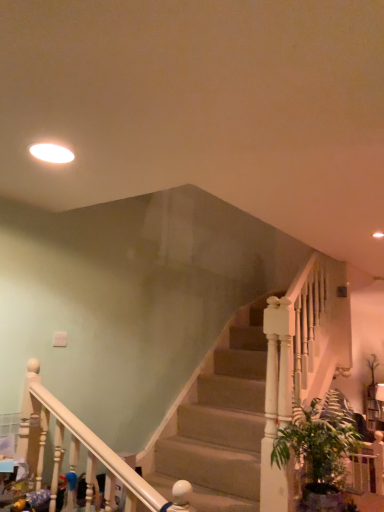
Describe the element at coordinates (51, 153) in the screenshot. The height and width of the screenshot is (512, 384). I see `white glossy light fixture at upper left` at that location.

What is the approximate width of white glossy light fixture at upper left?

It is 7.97 inches.

You are a GUI agent. You are given a task and a screenshot of the screen. Output one action in this format:
    pyautogui.click(x=<x>, y=<y>)
    Task: Click on the white glossy light fixture at upper left
    The image size is (384, 512).
    Given the screenshot: What is the action you would take?
    pyautogui.click(x=51, y=153)

Image resolution: width=384 pixels, height=512 pixels. I want to click on green leafy plant at lower right, so click(x=319, y=451).

What is the approximate width of green leafy plant at lower right?

16.85 inches.

Measure the distance between point (299, 438) and camera.

Point (299, 438) and camera are 2.38 meters apart from each other.

The image size is (384, 512). What do you see at coordinates (319, 451) in the screenshot?
I see `green leafy plant at lower right` at bounding box center [319, 451].

I want to click on white glossy light fixture at upper left, so click(51, 153).

Is green leafy plant at lower right to the right of white glossy light fixture at upper left from the viewer's perspective?

Correct, you'll find green leafy plant at lower right to the right of white glossy light fixture at upper left.

Which object is further away from the camera taking this photo, green leafy plant at lower right or white glossy light fixture at upper left?

Positioned behind is green leafy plant at lower right.

Is point (340, 489) closer or farther from the camera than point (57, 153)?

Clearly, point (340, 489) is more distant from the camera than point (57, 153).

From the image's perspective, would you say green leafy plant at lower right is shown under white glossy light fixture at upper left?

Yes.

From a real-world perspective, is green leafy plant at lower right under white glossy light fixture at upper left?

Yes, from a real-world perspective, green leafy plant at lower right is below white glossy light fixture at upper left.

Does green leafy plant at lower right have a greater width compared to white glossy light fixture at upper left?

Yes, green leafy plant at lower right is wider than white glossy light fixture at upper left.

Is green leafy plant at lower right taller than white glossy light fixture at upper left?

Indeed, green leafy plant at lower right has a greater height compared to white glossy light fixture at upper left.

Considering the sizes of objects green leafy plant at lower right and white glossy light fixture at upper left in the image provided, who is smaller, green leafy plant at lower right or white glossy light fixture at upper left?

Smaller between the two is white glossy light fixture at upper left.

Is green leafy plant at lower right not within white glossy light fixture at upper left?

green leafy plant at lower right lies outside white glossy light fixture at upper left's area.

Is green leafy plant at lower right next to white glossy light fixture at upper left?

They are not placed beside each other.

Is green leafy plant at lower right aimed at white glossy light fixture at upper left?

No.

The image size is (384, 512). In order to click on houseplant behind the white glossy light fixture at upper left in this screenshot , I will do `click(319, 451)`.

Considering the relative positions of white glossy light fixture at upper left and green leafy plant at lower right in the image provided, is white glossy light fixture at upper left to the left or to the right of green leafy plant at lower right?

Based on their positions, white glossy light fixture at upper left is located to the left of green leafy plant at lower right.

Which object is further away from the camera taking this photo, white glossy light fixture at upper left or green leafy plant at lower right?

green leafy plant at lower right is more distant.

Considering the points (50, 162) and (322, 467), which point is behind, point (50, 162) or point (322, 467)?

The point (322, 467) is farther.

From the image's perspective, which is below, white glossy light fixture at upper left or green leafy plant at lower right?

green leafy plant at lower right.

From the picture: From a real-world perspective, who is located lower, white glossy light fixture at upper left or green leafy plant at lower right?

green leafy plant at lower right is physically lower.

Considering the sizes of white glossy light fixture at upper left and green leafy plant at lower right in the image, is white glossy light fixture at upper left wider or thinner than green leafy plant at lower right?

white glossy light fixture at upper left is thinner than green leafy plant at lower right.

Who is shorter, white glossy light fixture at upper left or green leafy plant at lower right?

Standing shorter between the two is white glossy light fixture at upper left.

Does white glossy light fixture at upper left have a larger size compared to green leafy plant at lower right?

No.

Is white glossy light fixture at upper left not inside green leafy plant at lower right?

Yes, white glossy light fixture at upper left is located beyond the bounds of green leafy plant at lower right.

Are white glossy light fixture at upper left and green leafy plant at lower right located far from each other?

Yes.

Is white glossy light fixture at upper left positioned with its back to green leafy plant at lower right?

white glossy light fixture at upper left does not have its back to green leafy plant at lower right.

Find the location of `lighting on the left of green leafy plant at lower right`. lighting on the left of green leafy plant at lower right is located at coordinates (51, 153).

Image resolution: width=384 pixels, height=512 pixels. Find the location of `houseplant behind the white glossy light fixture at upper left`. houseplant behind the white glossy light fixture at upper left is located at coordinates (319, 451).

Where is `houseplant located on the right of white glossy light fixture at upper left`? This screenshot has height=512, width=384. houseplant located on the right of white glossy light fixture at upper left is located at coordinates (319, 451).